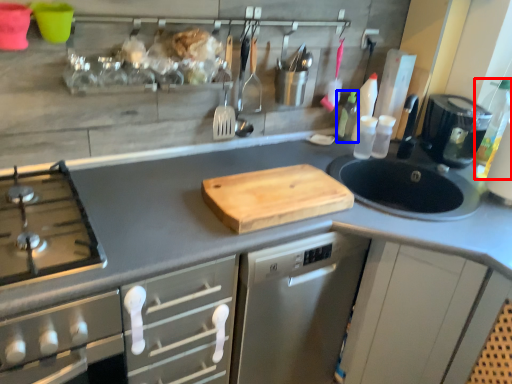
Question: Among these objects, which one is nearest to the camera, bottle (highlighted by a red box) or bottle (highlighted by a blue box)?

Choices:
 (A) bottle
 (B) bottle

Answer: (A)